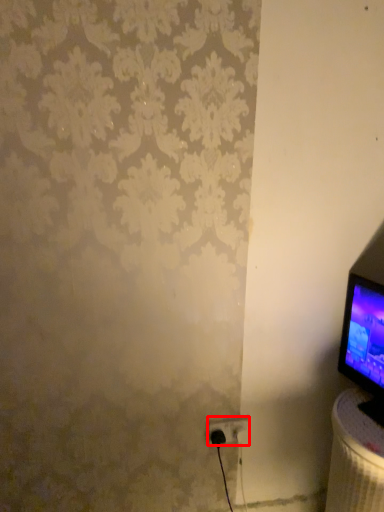
Question: Observing the image, what is the correct spatial positioning of power plugs and sockets (annotated by the red box) in reference to table?

Choices:
 (A) right
 (B) left

Answer: (B)